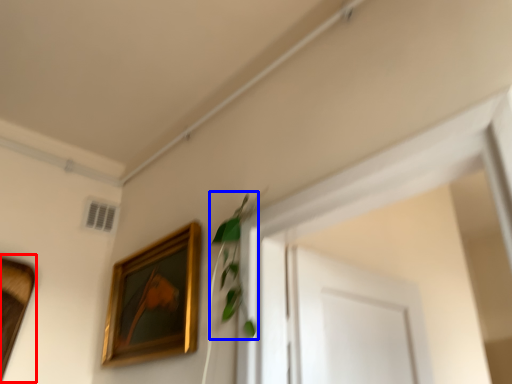
Question: Which object is further to the camera taking this photo, picture frame (highlighted by a red box) or plant (highlighted by a blue box)?

Choices:
 (A) picture frame
 (B) plant

Answer: (A)